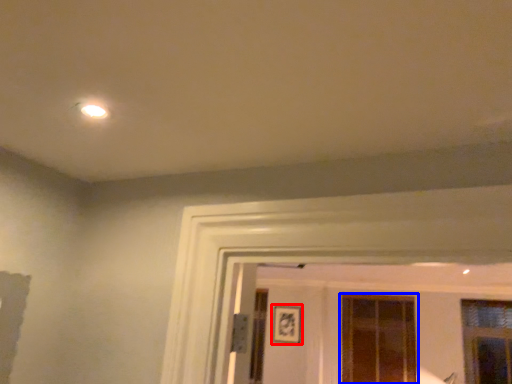
Question: Which point is closer to the camera, picture frame (highlighted by a red box) or window (highlighted by a blue box)?

Choices:
 (A) picture frame
 (B) window

Answer: (B)